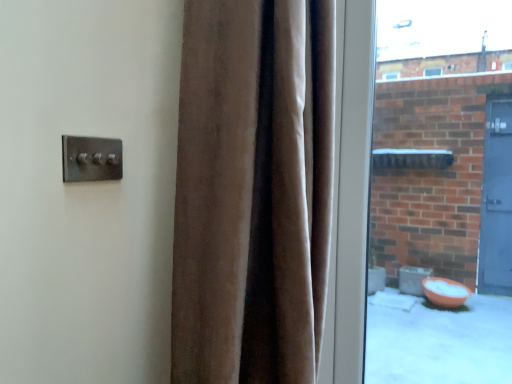
Question: Visually, is satin silver switch at upper left positioned to the left or to the right of clear glass window at right?

Choices:
 (A) right
 (B) left

Answer: (B)

Question: Is point (66, 145) closer or farther from the camera than point (457, 69)?

Choices:
 (A) farther
 (B) closer

Answer: (B)

Question: Which is farther from the satin silver switch at upper left?

Choices:
 (A) velvet brown curtain at center
 (B) clear glass window at right

Answer: (B)

Question: Estimate the real-world distances between objects in this image. Which object is farther from the clear glass window at right?

Choices:
 (A) velvet brown curtain at center
 (B) satin silver switch at upper left

Answer: (B)